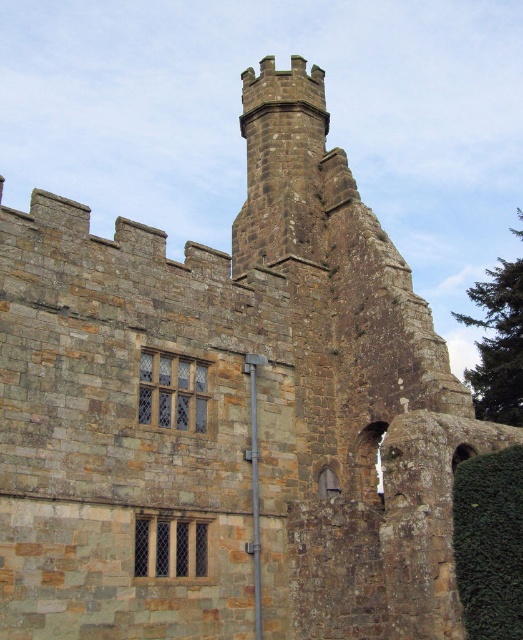
You are a gardener tasked with maintaining the ivy on the historic stone building. You need to water both the green leafy ivy at lower right and the green leafy ivy at right. Given that your watering can holds enough water for 50 feet of travel, can you water both ivies without refilling?

The green leafy ivy at lower right and green leafy ivy at right are 65.75 feet apart from each other. Since the distance exceeds the watering can capacity of 50 feet, you cannot water both without refilling.

You are standing in front of the historic stone building and notice two patches of green leafy ivy. One is labeled as green leafy ivy at lower right and the other as green leafy ivy at right. Which ivy is nearer to you?

The green leafy ivy at lower right is closer to the viewer than the green leafy ivy at right.

You are an architect inspecting the ivy growth on the historic stone building. You notice two patches of green leafy ivy at lower right and green leafy ivy at right. Which ivy patch is shorter in height?

The green leafy ivy at lower right is not as tall as the green leafy ivy at right, so the ivy at lower right is shorter in height.